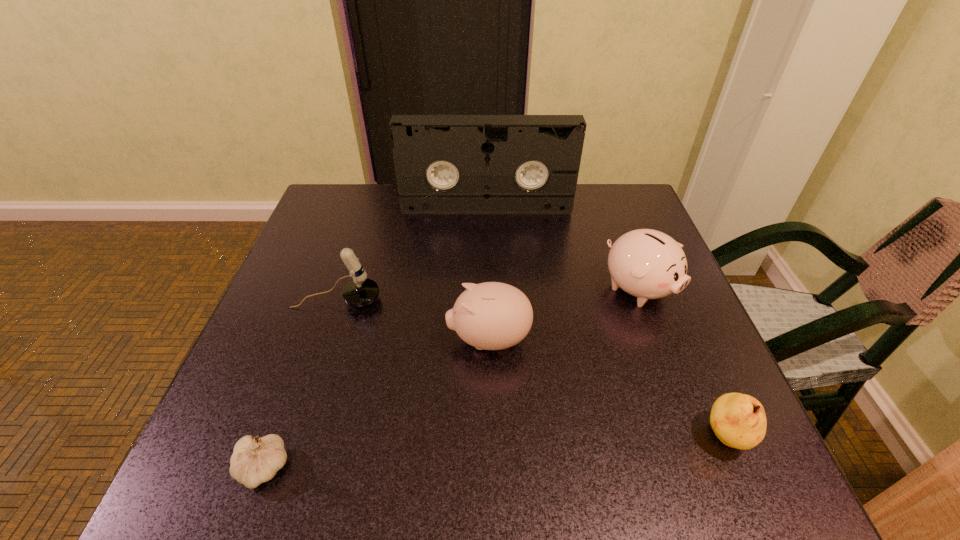
Identify the location of piggy bank located in the right edge section of the desktop. The image size is (960, 540). (648, 264).

Find the location of a particular element. The height and width of the screenshot is (540, 960). pear that is at the right edge is located at coordinates (739, 421).

Identify the location of object that is positioned at the near left corner. (253, 462).

Identify the location of object at the near right corner. [739, 421].

In the image, there is a desktop. At what (x,y) coordinates should I click in order to perform the action: click on vacant space at the far edge. Please return your answer as a coordinate pair (x, y). The image size is (960, 540). Looking at the image, I should click on (561, 218).

Find the location of a particular element. The height and width of the screenshot is (540, 960). blank space at the near edge of the desktop is located at coordinates (476, 469).

The width and height of the screenshot is (960, 540). What are the coordinates of `vacant space at the left edge` in the screenshot? It's located at (295, 396).

Where is `free space at the right edge of the desktop`? This screenshot has height=540, width=960. free space at the right edge of the desktop is located at coordinates (708, 347).

In the image, there is a desktop. At what (x,y) coordinates should I click in order to perform the action: click on vacant space at the far left corner. Please return your answer as a coordinate pair (x, y). The image size is (960, 540). Looking at the image, I should click on [370, 186].

The height and width of the screenshot is (540, 960). In order to click on vacant region at the far right corner of the desktop in this screenshot , I will do `click(598, 195)`.